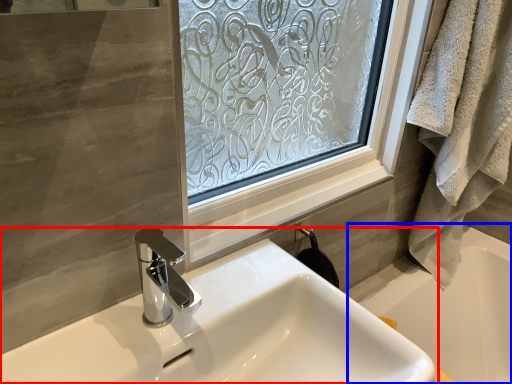
Question: Among these objects, which one is nearest to the camera, sink (highlighted by a red box) or bath (highlighted by a blue box)?

Choices:
 (A) sink
 (B) bath

Answer: (A)